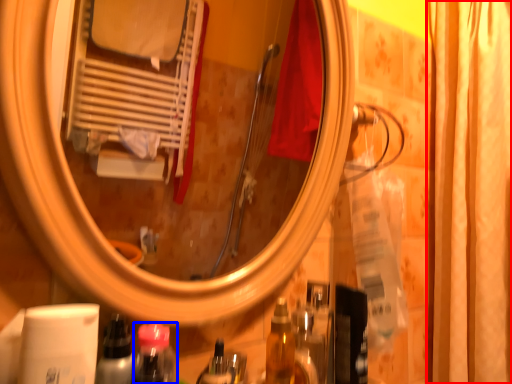
Question: Which point is closer to the camera, shower curtain (highlighted by a red box) or mouthwash (highlighted by a blue box)?

Choices:
 (A) shower curtain
 (B) mouthwash

Answer: (B)